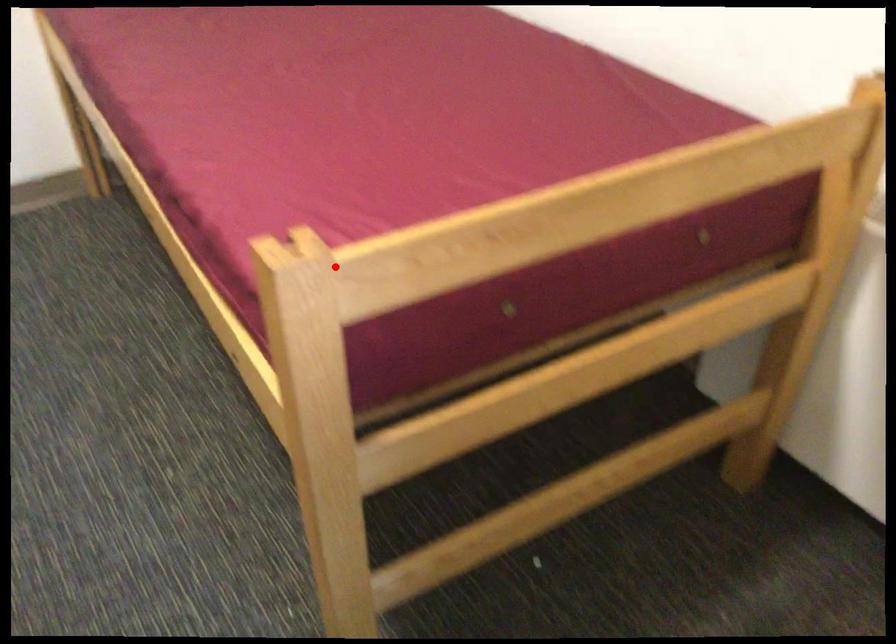
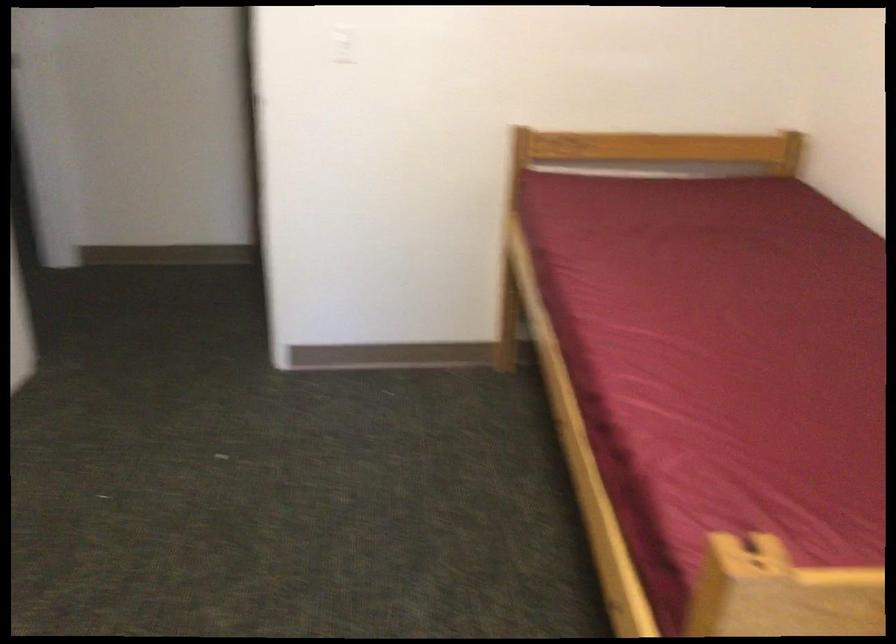
Find the pixel in the second image that matches the highlighted location in the first image.

(805, 603)